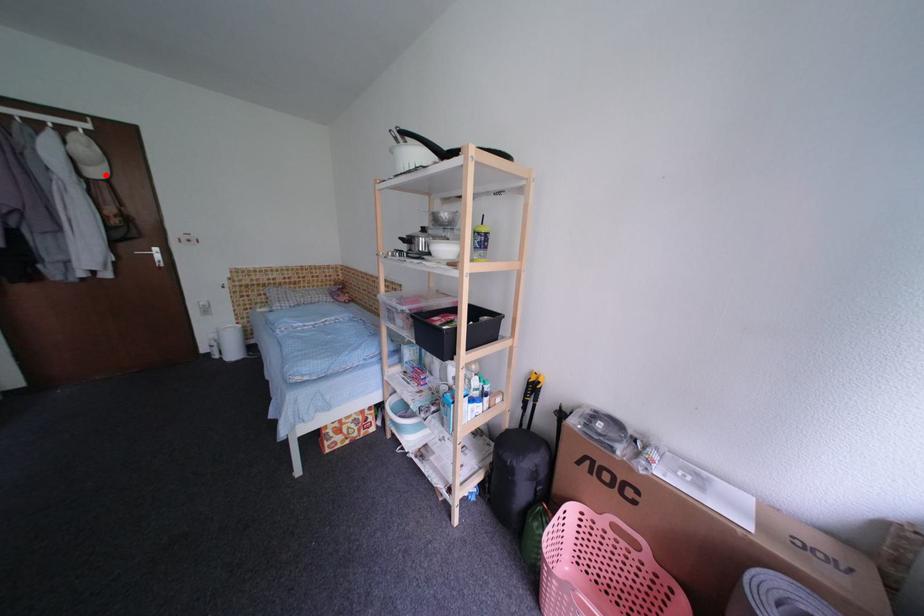
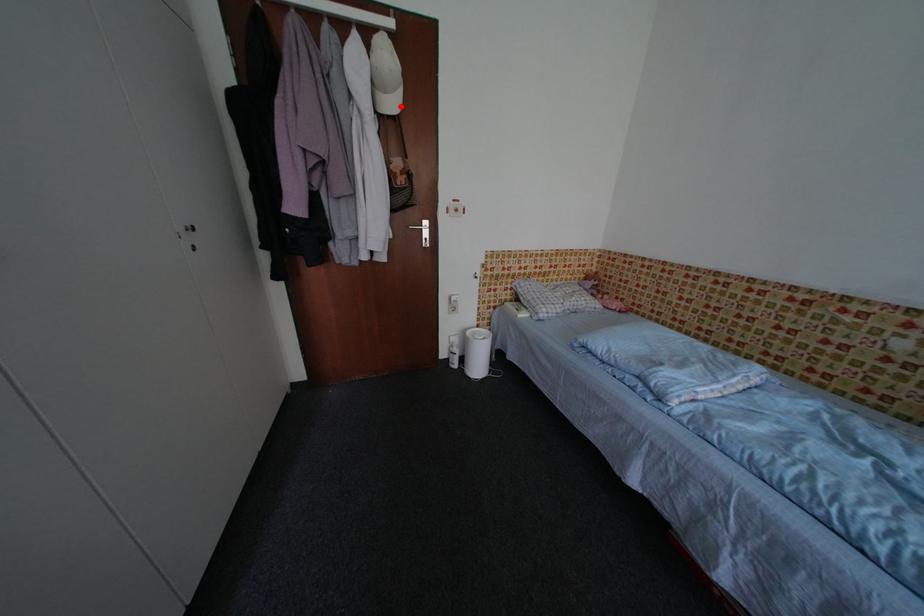
I am providing you with two images of the same scene from different viewpoints. A red point is marked on the first image and another point is marked on the second image. Are the points marked in image1 and image2 representing the same 3D position?

Yes